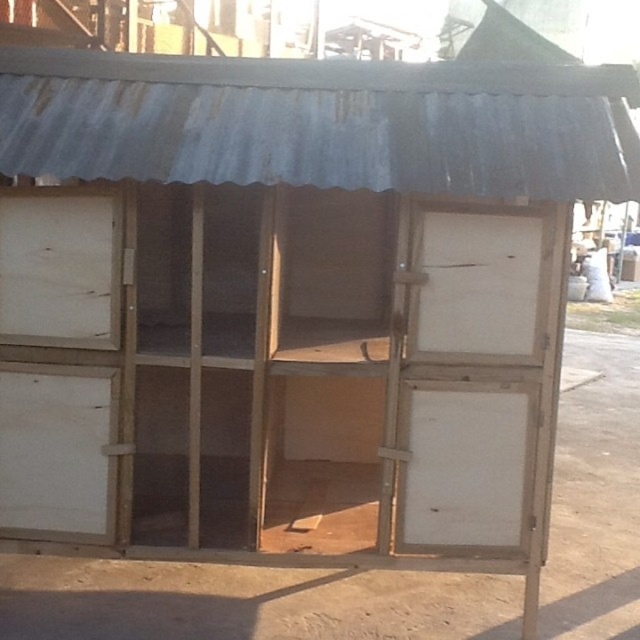
Is white matte drawer at lower left to the left of white matte drawer at left from the viewer's perspective?

Correct, you'll find white matte drawer at lower left to the left of white matte drawer at left.

Does white matte drawer at lower left have a lesser width compared to white matte drawer at left?

No, white matte drawer at lower left is not thinner than white matte drawer at left.

What do you see at coordinates (58, 451) in the screenshot? This screenshot has width=640, height=640. I see `white matte drawer at lower left` at bounding box center [58, 451].

Locate an element on the screen. The image size is (640, 640). white matte drawer at lower left is located at coordinates (58, 451).